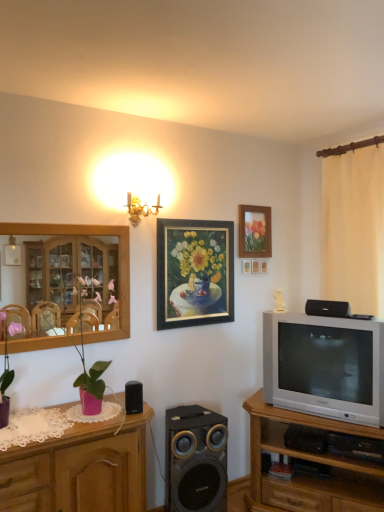
Question: Is pink matte vase at left, which is counted as the 2th plant, starting from the left, outside pink wood cabinet at left, the second cabinetry positioned from the right?

Choices:
 (A) yes
 (B) no

Answer: (A)

Question: Would you say pink matte vase at left, which is counted as the 2th plant, starting from the left, is a long distance from pink wood cabinet at left, which ranks as the 1th cabinetry in left-to-right order?

Choices:
 (A) yes
 (B) no

Answer: (B)

Question: Can you see pink matte vase at left, which is counted as the 2th plant, starting from the left, touching pink wood cabinet at left, the second cabinetry positioned from the right?

Choices:
 (A) no
 (B) yes

Answer: (A)

Question: Does pink matte vase at left, placed as the first plant when sorted from right to left, have a lesser height compared to pink wood cabinet at left, the second cabinetry positioned from the right?

Choices:
 (A) no
 (B) yes

Answer: (B)

Question: Does pink matte vase at left, which is counted as the 2th plant, starting from the left, appear on the left side of pink wood cabinet at left, the second cabinetry positioned from the right?

Choices:
 (A) yes
 (B) no

Answer: (B)

Question: In the image, is matte purple pot at left, the 1th plant when ordered from left to right, on the left side or the right side of black matte speaker at lower center, placed as the second speaker when sorted from right to left?

Choices:
 (A) right
 (B) left

Answer: (B)

Question: Is matte purple pot at left, the 1th plant when ordered from left to right, taller or shorter than black matte speaker at lower center, placed as the second speaker when sorted from right to left?

Choices:
 (A) short
 (B) tall

Answer: (A)

Question: Looking at their shapes, would you say matte purple pot at left, the 1th plant when ordered from left to right, is wider or thinner than black matte speaker at lower center, placed as the second speaker when sorted from right to left?

Choices:
 (A) thin
 (B) wide

Answer: (A)

Question: From a real-world perspective, relative to black matte speaker at lower center, which is the third speaker in top-to-bottom order, is matte purple pot at left, the 1th plant when ordered from left to right, vertically above or below?

Choices:
 (A) above
 (B) below

Answer: (A)

Question: From the image's perspective, is matte purple pot at left, the 1th plant when ordered from left to right, located above or below wooden tv stand at right, acting as the 1th cabinetry starting from the right?

Choices:
 (A) below
 (B) above

Answer: (B)

Question: In the image, is matte purple pot at left, which ranks as the second plant in right-to-left order, on the left side or the right side of wooden tv stand at right, the 2th cabinetry from the left?

Choices:
 (A) right
 (B) left

Answer: (B)

Question: Considering their positions, is matte purple pot at left, which ranks as the second plant in right-to-left order, located in front of or behind wooden tv stand at right, the 2th cabinetry from the left?

Choices:
 (A) front
 (B) behind

Answer: (A)

Question: Is matte purple pot at left, which ranks as the second plant in right-to-left order, bigger or smaller than wooden tv stand at right, acting as the 1th cabinetry starting from the right?

Choices:
 (A) small
 (B) big

Answer: (A)

Question: Looking at their shapes, would you say wooden tv stand at right, the 2th cabinetry from the left, is wider or thinner than black matte speaker at lower center, placed as the second speaker when sorted from right to left?

Choices:
 (A) wide
 (B) thin

Answer: (A)

Question: From a real-world perspective, is wooden tv stand at right, acting as the 1th cabinetry starting from the right, physically located above or below black matte speaker at lower center, which is the third speaker in top-to-bottom order?

Choices:
 (A) above
 (B) below

Answer: (B)